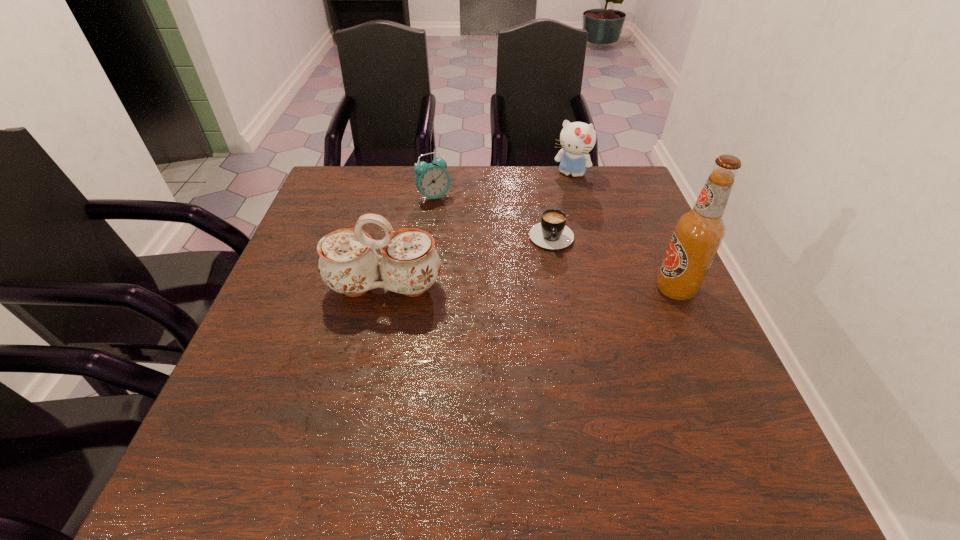
Where is `vacant spot on the desktop that is between the chinaware and the rightmost object and is positioned on the front-facing side of the kitten`? vacant spot on the desktop that is between the chinaware and the rightmost object and is positioned on the front-facing side of the kitten is located at coordinates (515, 288).

Locate an element on the screen. The height and width of the screenshot is (540, 960). free space on the desktop that is between the chinaware and the tallest object and is positioned on the face of the fourth nearest object is located at coordinates click(x=542, y=288).

You are a GUI agent. You are given a task and a screenshot of the screen. Output one action in this format:
    pyautogui.click(x=<x>, y=<y>)
    Task: Click on the vacant spot on the desktop that is between the chinaware and the beer bottle and is positioned with the handle on the side of the shortest object
    This screenshot has width=960, height=540.
    Given the screenshot: What is the action you would take?
    pyautogui.click(x=555, y=288)